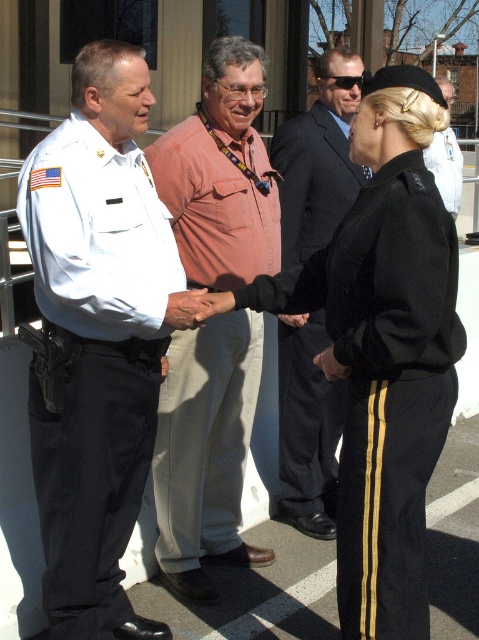
The width and height of the screenshot is (479, 640). Describe the element at coordinates (205, 451) in the screenshot. I see `pink cotton shirt at center` at that location.

Is pink cotton shirt at center below dark gray suit at center?

Incorrect, pink cotton shirt at center is not positioned below dark gray suit at center.

Who is more forward, (207,483) or (308,477)?

Point (207,483)

Locate an element on the screen. pink cotton shirt at center is located at coordinates (205, 451).

The width and height of the screenshot is (479, 640). Describe the element at coordinates (384, 349) in the screenshot. I see `black uniform at center` at that location.

Does black uniform at center appear on the left side of dark gray suit at center?

Yes, black uniform at center is to the left of dark gray suit at center.

At what (x,y) coordinates should I click in order to perform the action: click on black uniform at center. Please return your answer as a coordinate pair (x, y). Looking at the image, I should click on (384, 349).

Can you confirm if black uniform at center is positioned to the right of pink cotton shirt at center?

Indeed, black uniform at center is positioned on the right side of pink cotton shirt at center.

Which of these two, black uniform at center or pink cotton shirt at center, stands shorter?

black uniform at center is shorter.

Is point (443, 278) more distant than point (250, 252)?

No, it is not.

Where is `black uniform at center`? This screenshot has width=479, height=640. black uniform at center is located at coordinates (384, 349).